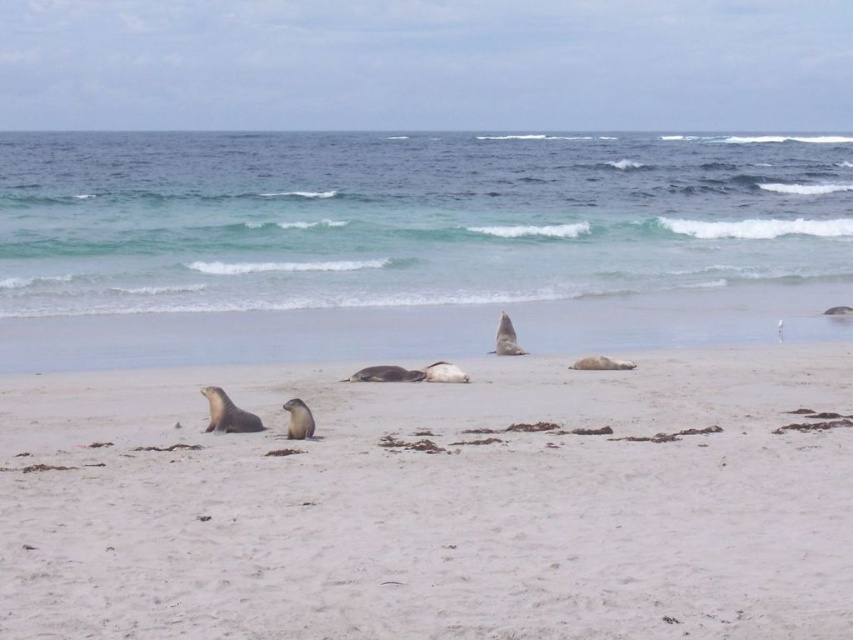
Between white sandy beach at center and blue-green water at upper center, which one appears on the left side from the viewer's perspective?

Positioned to the left is blue-green water at upper center.

Does white sandy beach at center appear under blue-green water at upper center?

Yes, white sandy beach at center is below blue-green water at upper center.

Find the location of a particular element. The image size is (853, 640). white sandy beach at center is located at coordinates (434, 504).